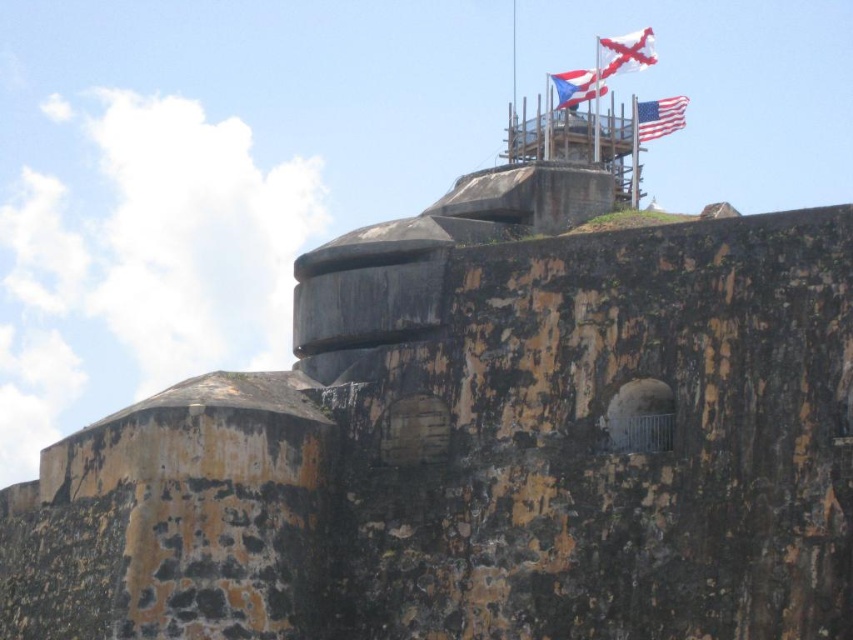
Which is more to the right, white striped fabric at top or matte american flag at upper right?

Positioned to the right is matte american flag at upper right.

Can you confirm if white striped fabric at top is positioned above matte american flag at upper right?

Correct, white striped fabric at top is located above matte american flag at upper right.

Which is in front, point (651, 54) or point (640, 104)?

Point (651, 54)

The width and height of the screenshot is (853, 640). Find the location of `white striped fabric at top`. white striped fabric at top is located at coordinates (625, 52).

Is point (599, 48) positioned behind point (560, 90)?

Yes.

Measure the distance between point (x=642, y=51) and camera.

Point (x=642, y=51) and camera are 110.43 meters apart.

Locate an element on the screen. The width and height of the screenshot is (853, 640). white striped fabric at top is located at coordinates (625, 52).

Does matte american flag at upper right have a lesser width compared to matte blue and white flag at top?

In fact, matte american flag at upper right might be wider than matte blue and white flag at top.

Measure the distance between matte american flag at upper right and camera.

matte american flag at upper right is 98.66 meters from camera.

Between point (639, 134) and point (577, 88), which one is positioned behind?

The point (577, 88) is behind.

This screenshot has width=853, height=640. What are the coordinates of `matte american flag at upper right` in the screenshot? It's located at (659, 116).